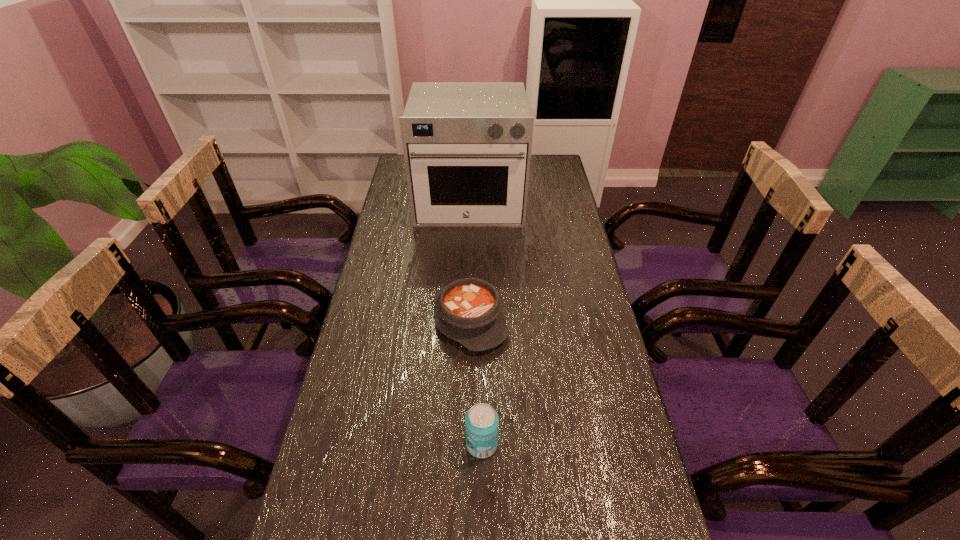
The height and width of the screenshot is (540, 960). In order to click on the farthest object in this screenshot , I will do `click(467, 146)`.

The image size is (960, 540). I want to click on the tallest object, so click(x=467, y=146).

At what (x,y) coordinates should I click in order to perform the action: click on beer can. Please return your answer as a coordinate pair (x, y). The height and width of the screenshot is (540, 960). Looking at the image, I should click on (481, 421).

The height and width of the screenshot is (540, 960). I want to click on the third shortest object, so click(481, 421).

The height and width of the screenshot is (540, 960). In order to click on the third tallest object in this screenshot , I will do `click(470, 311)`.

This screenshot has height=540, width=960. Find the location of `casserole`. casserole is located at coordinates (470, 311).

The height and width of the screenshot is (540, 960). Find the location of `vacant space located 0.220m on the front panel of the tallest object`. vacant space located 0.220m on the front panel of the tallest object is located at coordinates pyautogui.click(x=468, y=271).

The width and height of the screenshot is (960, 540). I want to click on vacant space situated on the front of the third shortest object, so click(482, 492).

Where is `free space located 0.370m on the back of the second shortest object`? The width and height of the screenshot is (960, 540). free space located 0.370m on the back of the second shortest object is located at coordinates (472, 220).

The image size is (960, 540). I want to click on object at the far edge, so click(x=467, y=146).